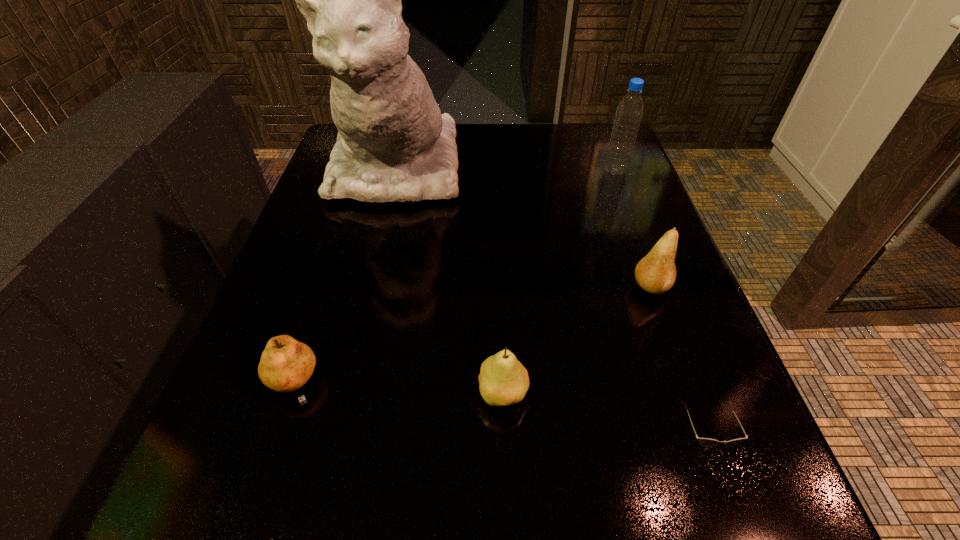
Where is `cat`? Image resolution: width=960 pixels, height=540 pixels. cat is located at coordinates (393, 144).

Locate an element on the screen. The height and width of the screenshot is (540, 960). water bottle is located at coordinates [x=629, y=112].

The image size is (960, 540). I want to click on the farthest pear, so click(655, 273).

Image resolution: width=960 pixels, height=540 pixels. In order to click on the rightmost pear in this screenshot , I will do `click(655, 273)`.

Where is `the second pear from right to left`? the second pear from right to left is located at coordinates (503, 380).

Identify the location of the fifth tallest object. This screenshot has width=960, height=540. (286, 365).

Identify the location of the leftmost pear. (286, 365).

At what (x,y) coordinates should I click in order to perform the action: click on the shortest object. Please return your answer as a coordinate pair (x, y). The image size is (960, 540). Looking at the image, I should click on (706, 442).

The width and height of the screenshot is (960, 540). What are the coordinates of `free space located on the front-facing side of the tallest object` in the screenshot? It's located at (376, 251).

The image size is (960, 540). Find the location of `vacant space located 0.160m on the back of the fifth shortest object`. vacant space located 0.160m on the back of the fifth shortest object is located at coordinates (600, 132).